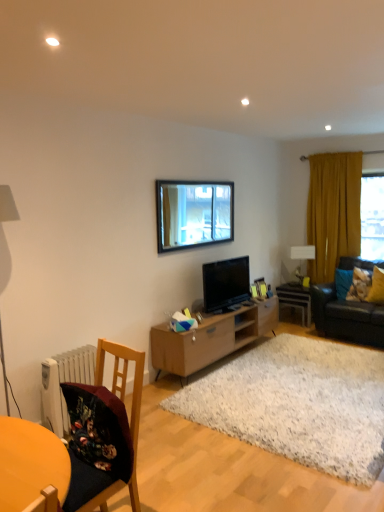
Question: Relative to wooden chair at lower left, is mustard yellow fabric curtain at right in front or behind?

Choices:
 (A) behind
 (B) front

Answer: (A)

Question: From the image's perspective, is mustard yellow fabric curtain at right above or below wooden chair at lower left?

Choices:
 (A) below
 (B) above

Answer: (B)

Question: Estimate the real-world distances between objects in this image. Which object is farther from the black leather couch at right?

Choices:
 (A) satin black tv at center
 (B) yellow fabric pillow at right, which is the 2th pillow from right to left
 (C) yellow fabric pillow at right, acting as the second pillow starting from the left
 (D) white glossy lampshade at upper right
 (E) wooden picture frame at center, placed as the 2th picture frame when sorted from right to left

Answer: (A)

Question: Which is nearer to the yellow fabric pillow at right, positioned as the 1th pillow in right-to-left order?

Choices:
 (A) light brown wood tv stand at center
 (B) mustard yellow fabric curtain at right
 (C) white glossy side table at center
 (D) wooden picture frame at center, which appears as the 1th picture frame when viewed from the right
 (E) white glossy lampshade at upper right

Answer: (C)